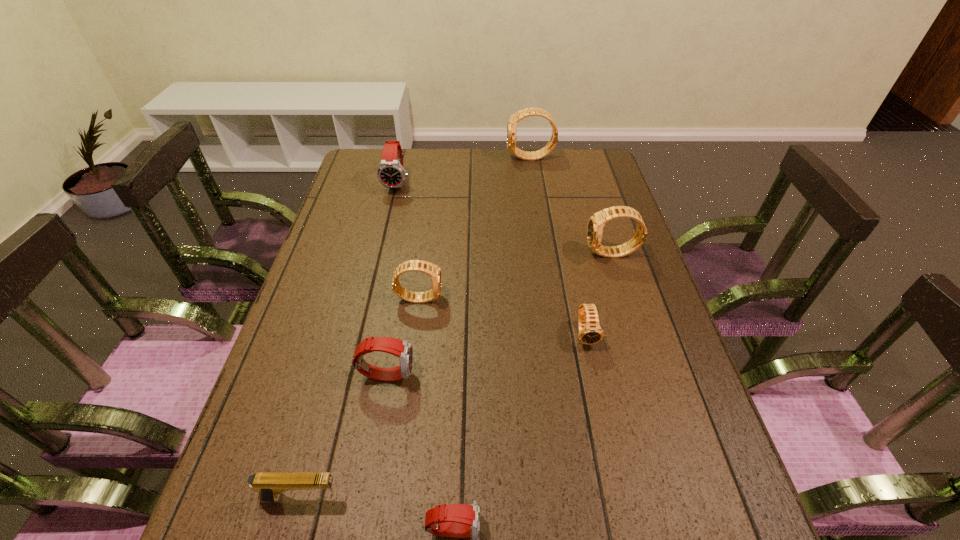
This screenshot has height=540, width=960. I want to click on vacant space at the left edge of the desktop, so click(379, 220).

I want to click on vacant space at the right edge of the desktop, so click(632, 381).

This screenshot has height=540, width=960. Identify the location of vacant region at the far right corner. (593, 156).

At what (x,y) coordinates should I click in order to perform the action: click on vacant space that is in between the nearest black watch and the farthest watch. Please return your answer as a coordinate pair (x, y). Looking at the image, I should click on (559, 246).

Where is `vacant space that is in between the sixth farthest watch and the biggest black watch`? The height and width of the screenshot is (540, 960). vacant space that is in between the sixth farthest watch and the biggest black watch is located at coordinates (459, 266).

At what (x,y) coordinates should I click in order to perform the action: click on unoccupied area between the rightmost watch and the farthest black watch. Please return your answer as a coordinate pair (x, y). The height and width of the screenshot is (540, 960). Looking at the image, I should click on (571, 206).

Locate an element on the screen. free space between the tan pistol and the rightmost object is located at coordinates (457, 376).

At what (x,y) coordinates should I click in order to perform the action: click on free space between the second smallest black watch and the third farthest object. Please return your answer as a coordinate pair (x, y). Looking at the image, I should click on (516, 276).

I want to click on free space between the biggest black watch and the biggest red watch, so click(x=465, y=171).

Locate an element on the screen. empty space between the pistol and the second farthest object is located at coordinates (349, 341).